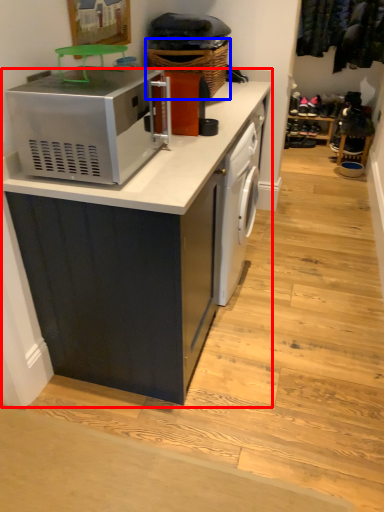
Question: Which object is further to the camera taking this photo, cabinetry (highlighted by a red box) or basket (highlighted by a blue box)?

Choices:
 (A) cabinetry
 (B) basket

Answer: (B)